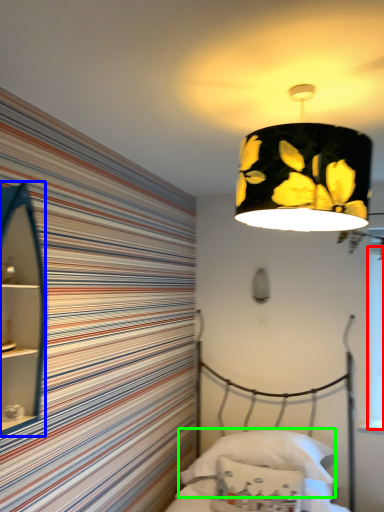
Question: Which is farther away from window screen (highlighted by a red box)? cabinet (highlighted by a blue box) or pillow (highlighted by a green box)?

Choices:
 (A) cabinet
 (B) pillow

Answer: (A)